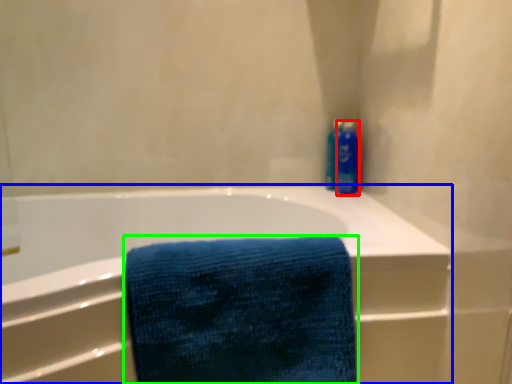
Question: Which object is positioned farthest from cleaning product (highlighted by a red box)? Select from bathtub (highlighted by a blue box) and towel (highlighted by a green box).

Choices:
 (A) bathtub
 (B) towel

Answer: (B)